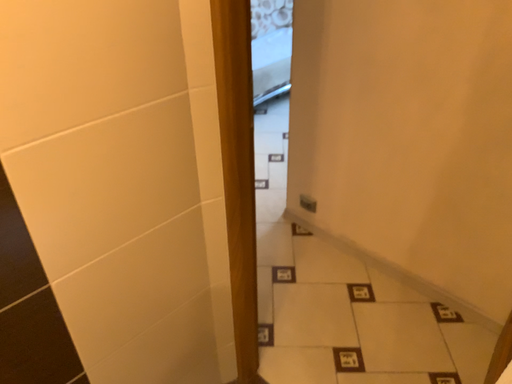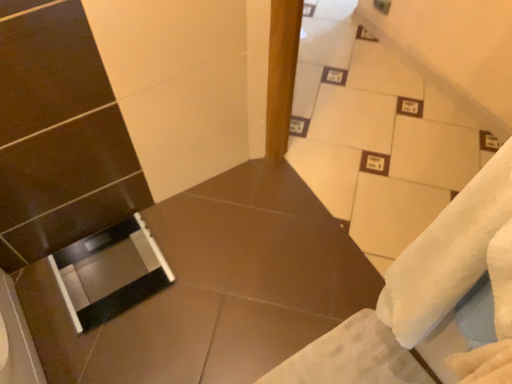
Question: How did the camera likely rotate when shooting the video?

Choices:
 (A) rotated right
 (B) rotated left

Answer: (B)